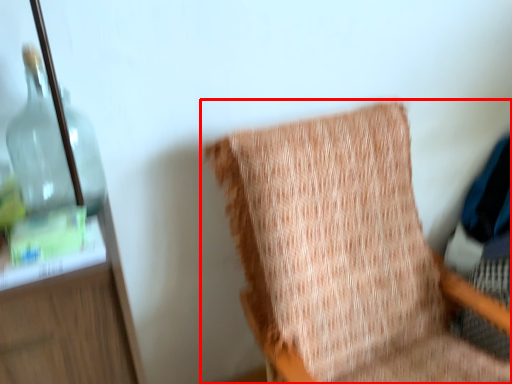
Question: From the image's perspective, where is chair (annotated by the red box) located relative to bottle?

Choices:
 (A) below
 (B) above

Answer: (A)